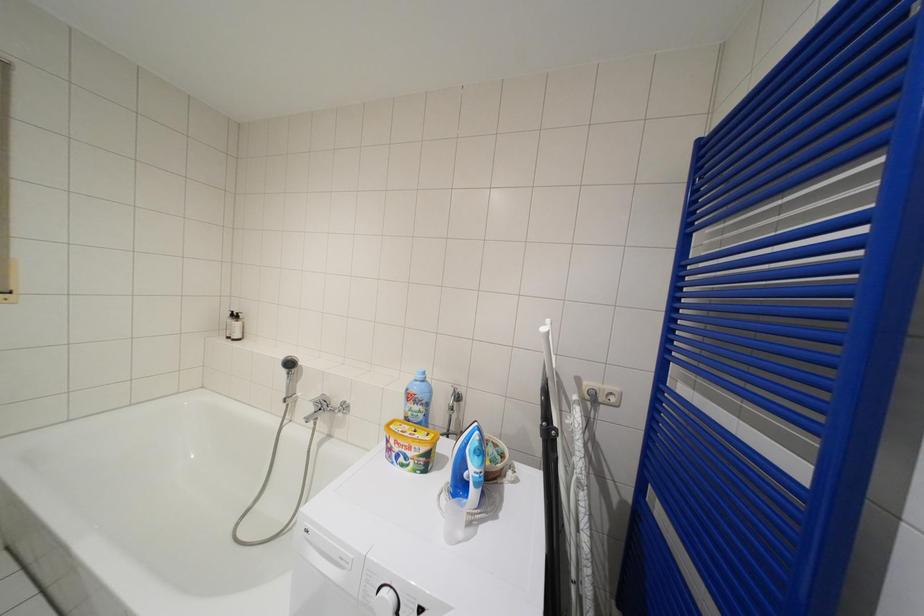
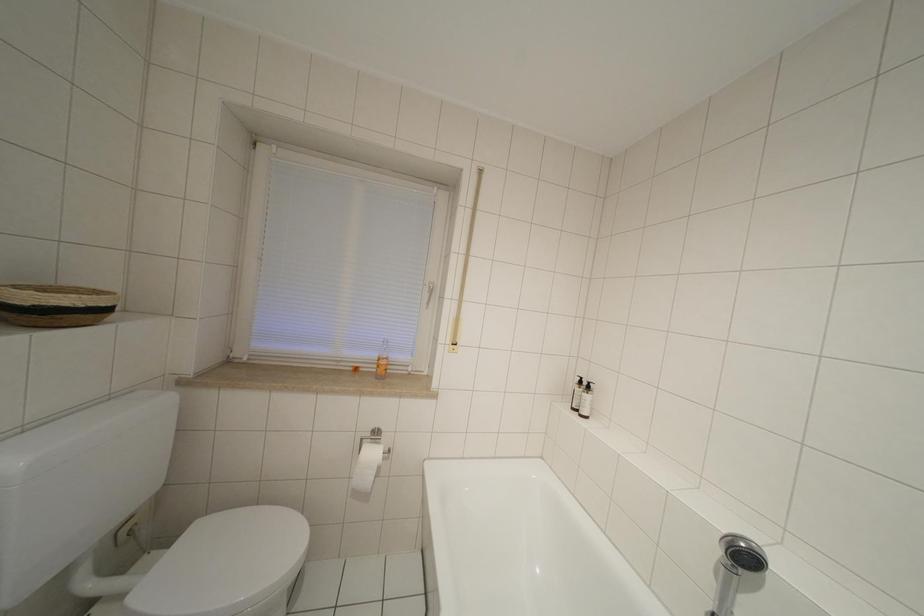
Question: How did the camera likely rotate?

Choices:
 (A) Left
 (B) Right
 (C) Up
 (D) Down

Answer: (A)